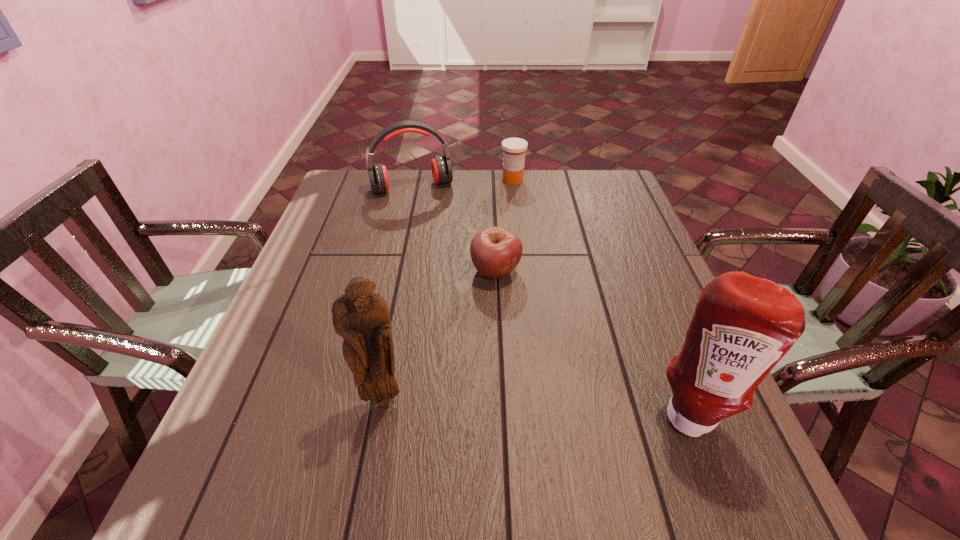
You are a GUI agent. You are given a task and a screenshot of the screen. Output one action in this format:
    pyautogui.click(x=<x>, y=<y>)
    Task: Click on the vacant space on the desktop that is between the figurine and the rightmost object and is positioned on the side of the apple with the unique marking
    The image size is (960, 540).
    Given the screenshot: What is the action you would take?
    click(x=552, y=407)

Find the location of a particular element. vacant spot on the desktop that is between the figurine and the condiment and is positioned on the label of the fourth tallest object is located at coordinates coord(511,406).

Identify the location of free space on the desktop that is between the figurine and the condiment and is positioned on the ear cups of the earphone. This screenshot has width=960, height=540. (490, 404).